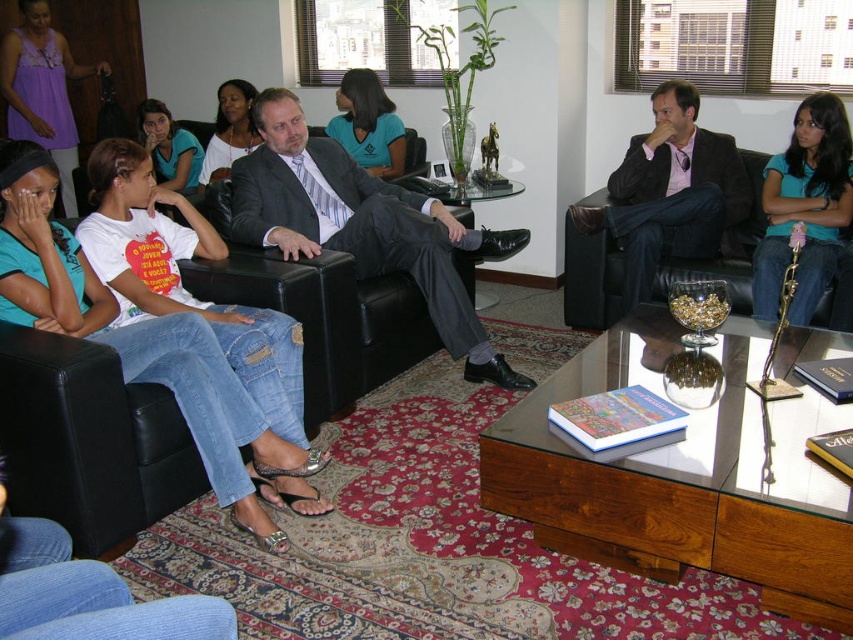
Question: Is blue jeans at left to the left of matte teal shirt at center from the viewer's perspective?

Choices:
 (A) yes
 (B) no

Answer: (A)

Question: Which point is farther to the camera?

Choices:
 (A) matte black suit at center
 (B) matte gray suit at center

Answer: (A)

Question: Among these objects, which one is nearest to the camera?

Choices:
 (A) purple cotton tank top at upper left
 (B) blue jeans at left
 (C) matte black dress at center
 (D) matte black suit at center

Answer: (B)

Question: Estimate the real-world distances between objects in this image. Which object is farther from the matte black dress at center?

Choices:
 (A) purple cotton tank top at upper left
 (B) black leather couch at center
 (C) matte blue shirt at center
 (D) teal matte shirt at upper right

Answer: (D)

Question: Does matte teal shirt at center come in front of matte blue shirt at center?

Choices:
 (A) yes
 (B) no

Answer: (B)

Question: Can you confirm if blue jeans at left is positioned to the left of purple cotton tank top at upper left?

Choices:
 (A) yes
 (B) no

Answer: (B)